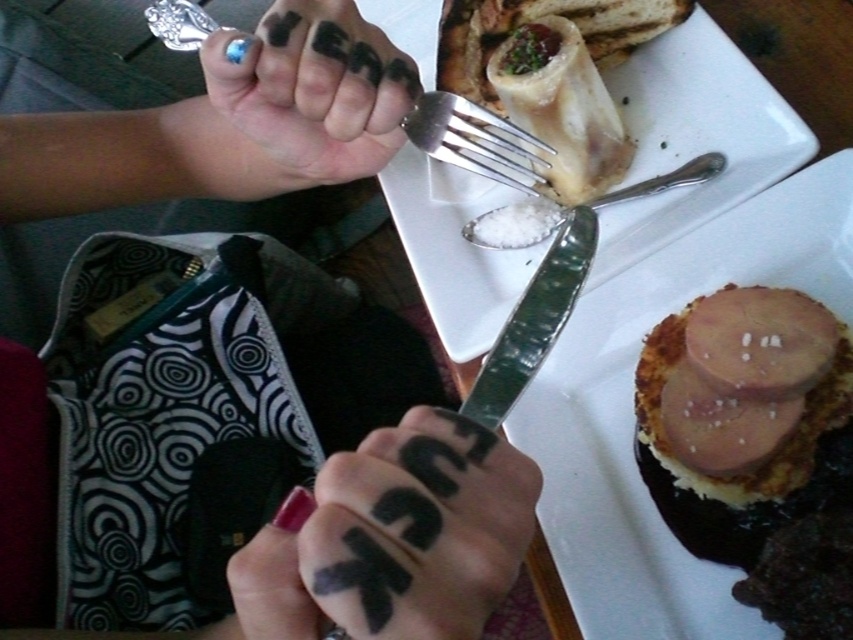
Between point (485, 429) and point (712, 140), which one is positioned behind?

Positioned behind is point (712, 140).

Between point (473, 429) and point (459, 204), which one is positioned in front?

Point (473, 429) is in front.

Does point (520, 522) lie behind point (782, 144)?

No, (520, 522) is in front of (782, 144).

Image resolution: width=853 pixels, height=640 pixels. I want to click on black matte knuckles at center, so click(392, 538).

Can you confirm if slightly pinkish matte ham at upper right is wider than silver metallic fork at upper center?

No.

Between slightly pinkish matte ham at upper right and silver metallic fork at upper center, which one is positioned lower?

slightly pinkish matte ham at upper right is below.

What do you see at coordinates (744, 417) in the screenshot? The image size is (853, 640). I see `slightly pinkish matte ham at upper right` at bounding box center [744, 417].

Locate an element on the screen. Image resolution: width=853 pixels, height=640 pixels. slightly pinkish matte ham at upper right is located at coordinates 744,417.

Does white ceramic plate at center lie in front of slightly pinkish matte ham at upper right?

No.

Can you confirm if white ceramic plate at center is smaller than slightly pinkish matte ham at upper right?

Incorrect, white ceramic plate at center is not smaller in size than slightly pinkish matte ham at upper right.

Does point (741, 68) come behind point (840, 332)?

Yes, it is.

Find the location of a particular element. The height and width of the screenshot is (640, 853). white ceramic plate at center is located at coordinates (693, 138).